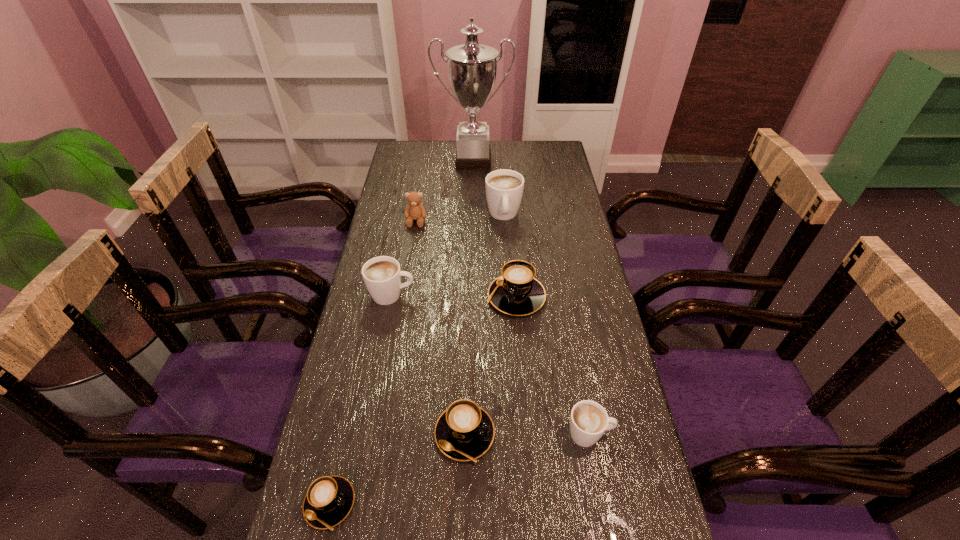
This screenshot has width=960, height=540. What are the coordinates of `vacant area situated 0.130m on the back of the shortest object` in the screenshot? It's located at (348, 421).

The width and height of the screenshot is (960, 540). I want to click on object that is positioned at the far edge, so click(x=472, y=67).

At what (x,y) coordinates should I click in order to perform the action: click on teddy bear that is positioned at the left edge. Please return your answer as a coordinate pair (x, y). Image resolution: width=960 pixels, height=540 pixels. Looking at the image, I should click on (415, 210).

Where is `object that is at the right edge`? The height and width of the screenshot is (540, 960). object that is at the right edge is located at coordinates (589, 420).

Locate an element on the screen. blank space at the left edge of the desktop is located at coordinates (425, 195).

The height and width of the screenshot is (540, 960). In the image, there is a desktop. What are the coordinates of `free space at the far left corner` in the screenshot? It's located at (396, 163).

The width and height of the screenshot is (960, 540). What are the coordinates of `free point between the brown teddy bear and the second farthest black cappuccino` in the screenshot? It's located at (441, 327).

At what (x,y) coordinates should I click in order to perform the action: click on empty location between the second white cappuccino from left to right and the nearest cappuccino. Please return your answer as a coordinate pair (x, y). Image resolution: width=960 pixels, height=540 pixels. Looking at the image, I should click on (417, 359).

This screenshot has width=960, height=540. Find the location of `vacant space that is in between the nearest black cappuccino and the second nearest white cappuccino`. vacant space that is in between the nearest black cappuccino and the second nearest white cappuccino is located at coordinates (361, 399).

Locate an element on the screen. The width and height of the screenshot is (960, 540). vacant area that lies between the farthest black cappuccino and the farthest cappuccino is located at coordinates (510, 256).